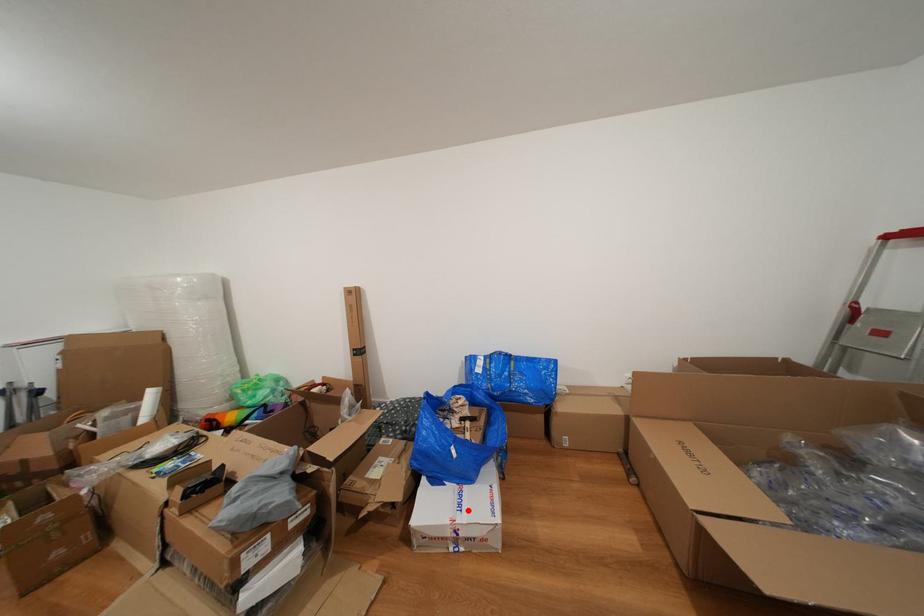
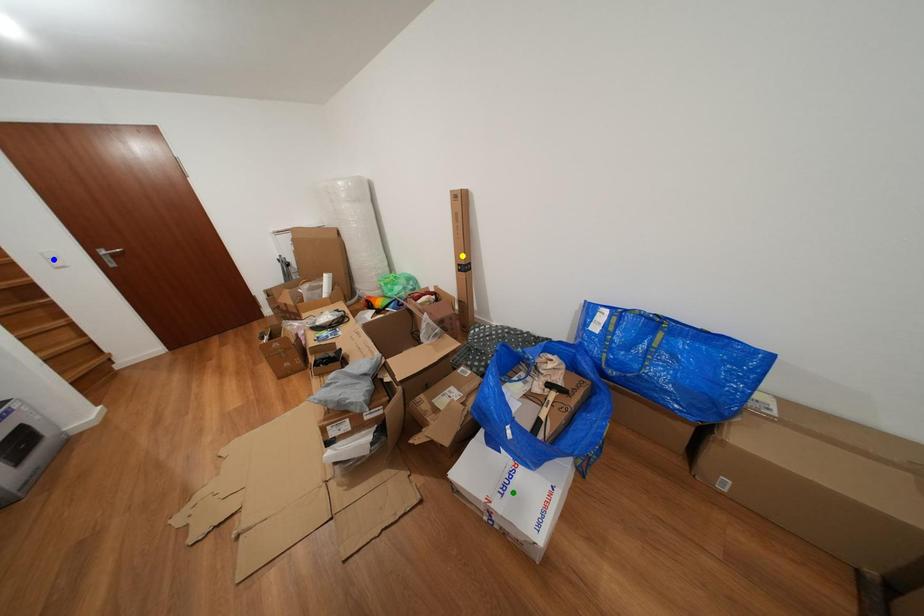
Question: I am providing you with two images of the same scene from different viewpoints. A red point is marked on the first image. You are given multiple points on the second image. Which mark in image 2 goes with the point in image 1?

Choices:
 (A) green point
 (B) blue point
 (C) yellow point

Answer: (A)